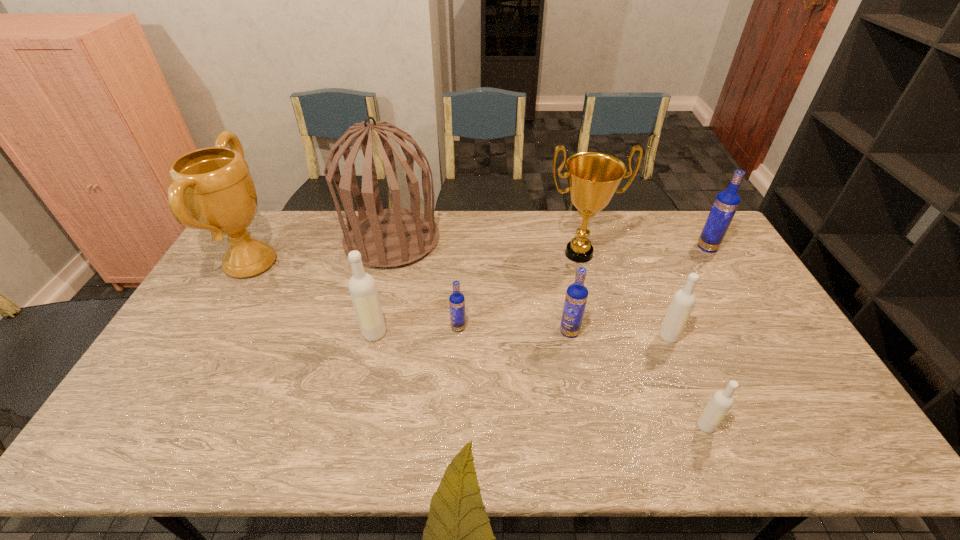
Image resolution: width=960 pixels, height=540 pixels. What are the coordinates of `free space between the second blue vodka from right to left and the second smallest white vodka` in the screenshot? It's located at (619, 334).

The width and height of the screenshot is (960, 540). Find the location of `blank region between the second smallest white vodka and the fourth vodka from right to left`. blank region between the second smallest white vodka and the fourth vodka from right to left is located at coordinates (619, 334).

The width and height of the screenshot is (960, 540). Identify the location of free space between the farthest blue vodka and the birdcage. (549, 244).

The image size is (960, 540). What are the coordinates of `the eighth closest object to the fifth vodka from right to left` in the screenshot? It's located at (726, 203).

I want to click on object that can be found as the fourth closest to the leftmost object, so click(x=593, y=178).

Find the location of a particular element. Image resolution: width=960 pixels, height=540 pixels. vodka that is the fifth closest to the fourth object from left to right is located at coordinates (726, 203).

Identify the location of vodka that stands as the closest to the smallest blue vodka. The height and width of the screenshot is (540, 960). (362, 287).

Where is `blue vodka that stands as the second closest to the rightmost object`? The height and width of the screenshot is (540, 960). blue vodka that stands as the second closest to the rightmost object is located at coordinates (456, 300).

Image resolution: width=960 pixels, height=540 pixels. I want to click on blue vodka that is the nearest to the leftmost blue vodka, so click(576, 296).

Identify which white vodka is the third closest to the rightmost vodka. Please provide its 2D coordinates. Your answer should be formatted as a tuple, i.e. [(x, y)], where the tuple contains the x and y coordinates of a point satisfying the conditions above.

[(362, 287)]